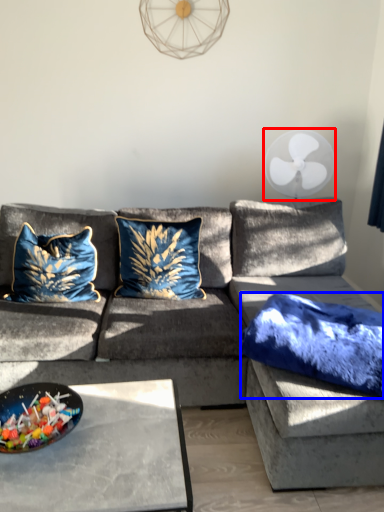
Question: Which of the following is the closest to the observer, mechanical fan (highlighted by a red box) or pillow (highlighted by a blue box)?

Choices:
 (A) mechanical fan
 (B) pillow

Answer: (B)